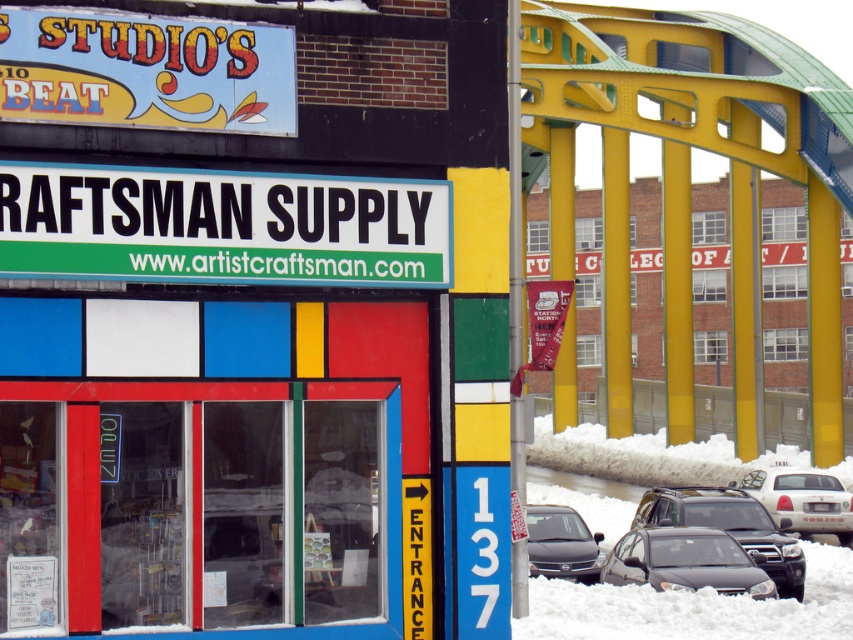
You are a delivery driver who needs to park your vehicle in the parking spot near the Craftsman Supply store entrance. The parking spot is designed to accommodate vehicles no larger than the white glossy taxi at lower right. Can your vehicle, which is the same size as the satin black sedan at lower center, fit into this parking spot?

The satin black sedan at lower center is smaller than the white glossy taxi at lower right. Since the parking spot can accommodate vehicles up to the size of the white glossy taxi at lower right, the satin black sedan at lower center will fit comfortably within the designated space.

You are a delivery driver who needs to park your vehicle, which is 2 meters wide, in front of the Craftsman Supply store. You see a satin black sedan at lower center and a white glossy taxi at lower right. Can your vehicle fit in the space between them?

The satin black sedan at lower center is narrower than the white glossy taxi at lower right. However, the exact width between them isn t specified, so we can t determine if your 2 meter wide vehicle will fit. Please check the available space physically.

You are standing in front of the Craftsman Supply store and want to take a photo. There are two points of interest marked as point 1 at coordinates [204,198] and point 2 at coordinates [637,515]. To ensure both points are in focus, which point should you focus on first?

You should focus on point 1 at coordinates [204,198] first because it is closer to the camera than point 2 at coordinates [637,515]. This way, both points will be in focus when you adjust the camera settings.